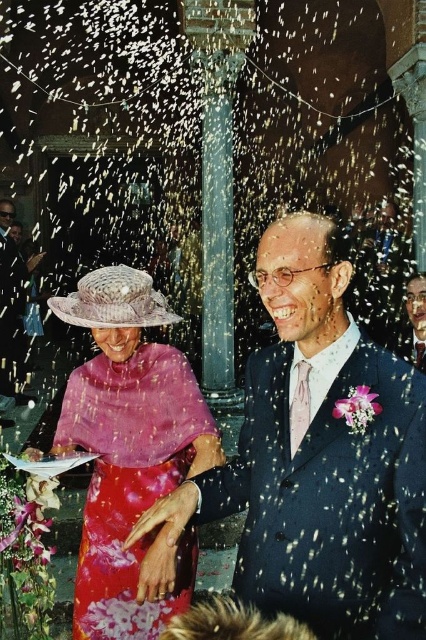
In the scene shown: Between matte pink fabric dress at center and smooth blue suit at center, which one appears on the right side from the viewer's perspective?

smooth blue suit at center

Is matte pink fabric dress at center thinner than smooth blue suit at center?

No, matte pink fabric dress at center is not thinner than smooth blue suit at center.

Is point (120, 468) closer to viewer compared to point (425, 339)?

That is True.

Where is `matte pink fabric dress at center`? This screenshot has width=426, height=640. matte pink fabric dress at center is located at coordinates (129, 452).

Who is positioned more to the left, matte pink fabric dress at center or matte black suit at left?

From the viewer's perspective, matte black suit at left appears more on the left side.

Does point (123, 291) come closer to viewer compared to point (5, 228)?

Yes.

Image resolution: width=426 pixels, height=640 pixels. Find the location of `matte pink fabric dress at center`. matte pink fabric dress at center is located at coordinates (129, 452).

Is point (255, 556) more distant than point (129, 472)?

No.

Describe the element at coordinates (319, 458) in the screenshot. This screenshot has width=426, height=640. I see `matte black suit at center` at that location.

Locate an element on the screen. This screenshot has height=640, width=426. matte black suit at center is located at coordinates (319, 458).